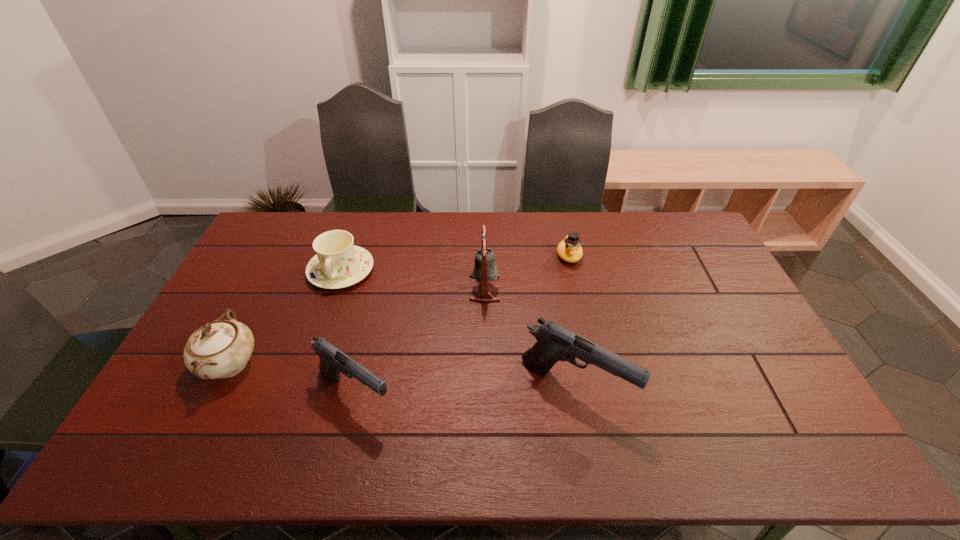
Identify the location of the shorter gun. The width and height of the screenshot is (960, 540). (333, 361).

I want to click on the right gun, so [555, 343].

In order to click on the right chinaware in this screenshot , I will do `click(338, 263)`.

Find the location of a particular element. the farther chinaware is located at coordinates (338, 263).

The image size is (960, 540). In order to click on duck in this screenshot , I will do `click(569, 249)`.

Find the location of a particular element. The height and width of the screenshot is (540, 960). bell is located at coordinates (484, 271).

This screenshot has height=540, width=960. I want to click on the taller chinaware, so click(220, 349).

The image size is (960, 540). Identify the location of the nearer chinaware. (220, 349).

Identify the location of vacant space located at the muzzle of the left gun. (425, 395).

I want to click on free space located 0.260m at the muzzle of the right gun, so click(x=723, y=389).